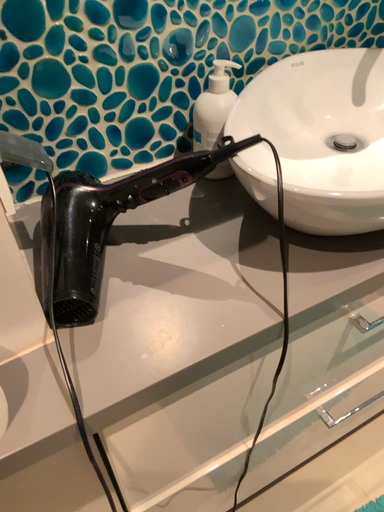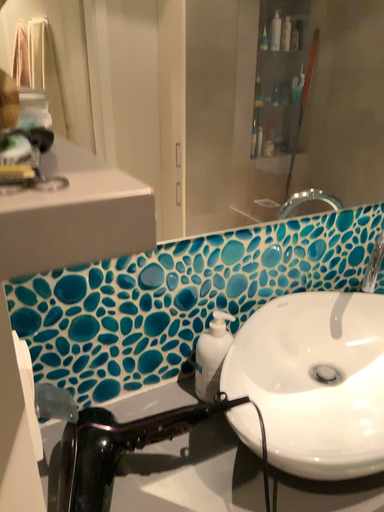
Question: How did the camera likely rotate when shooting the video?

Choices:
 (A) rotated downward
 (B) rotated upward

Answer: (B)